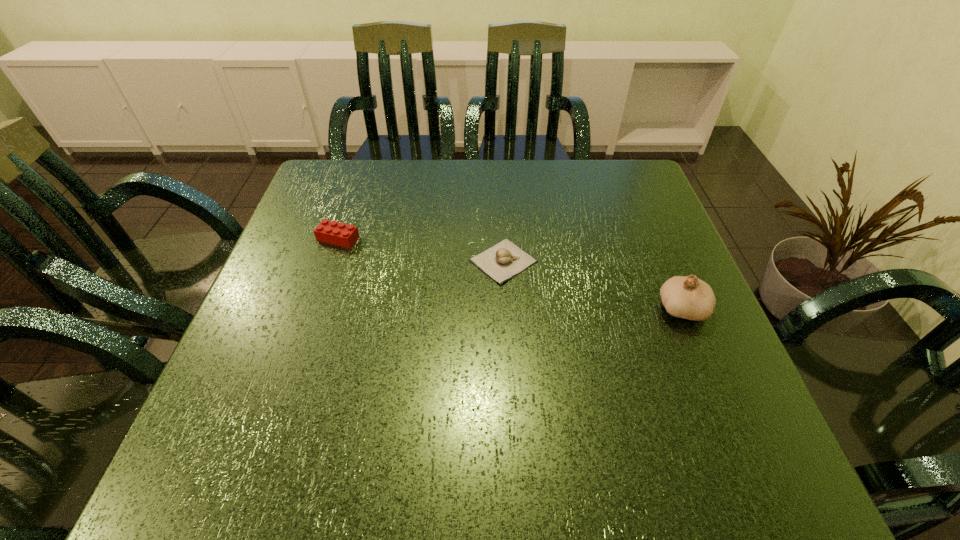
Where is `object located in the right edge section of the desktop`? The height and width of the screenshot is (540, 960). object located in the right edge section of the desktop is located at coordinates point(688,297).

In the image, there is a desktop. Where is `vacant space at the far edge`? vacant space at the far edge is located at coordinates (474, 187).

In the image, there is a desktop. Where is `vacant area at the near edge`? vacant area at the near edge is located at coordinates point(308,482).

In order to click on vacant space at the left edge in this screenshot , I will do `click(292, 290)`.

Identify the location of vacant region at the right edge of the desktop. (650, 389).

Image resolution: width=960 pixels, height=540 pixels. What are the coordinates of `vacant region at the far left corner of the desktop` in the screenshot? It's located at tap(349, 200).

At what (x,y) coordinates should I click in order to perform the action: click on vacant space at the near left corner of the desktop. Please return your answer as a coordinate pair (x, y). This screenshot has width=960, height=540. Looking at the image, I should click on (277, 436).

You are a GUI agent. You are given a task and a screenshot of the screen. Output one action in this format:
    pyautogui.click(x=<x>, y=<y>)
    Task: Click on the vacant space at the far right corner of the desktop
    The image size is (960, 540).
    Given the screenshot: What is the action you would take?
    pyautogui.click(x=614, y=178)

Locate an element on the screen. Image resolution: width=960 pixels, height=540 pixels. blank region between the second object from left to right and the nearer garlic is located at coordinates (592, 284).

In order to click on free space between the second shortest object and the farther garlic in this screenshot , I will do `click(420, 249)`.